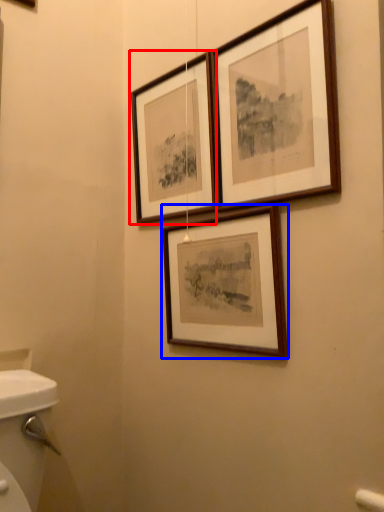
Question: Which of the following is the farthest to the observer, picture frame (highlighted by a red box) or picture frame (highlighted by a blue box)?

Choices:
 (A) picture frame
 (B) picture frame

Answer: (A)